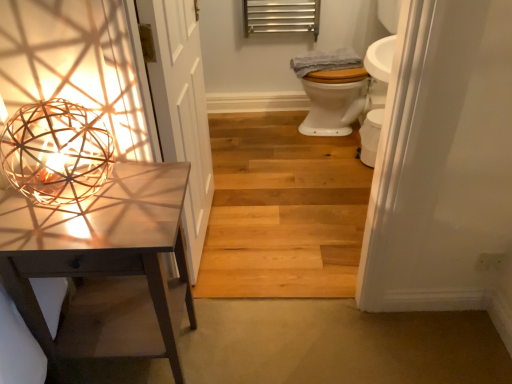
Where is `free spot below woven wood sphere at left (from a real-world perspective)`? The height and width of the screenshot is (384, 512). free spot below woven wood sphere at left (from a real-world perspective) is located at coordinates (72, 212).